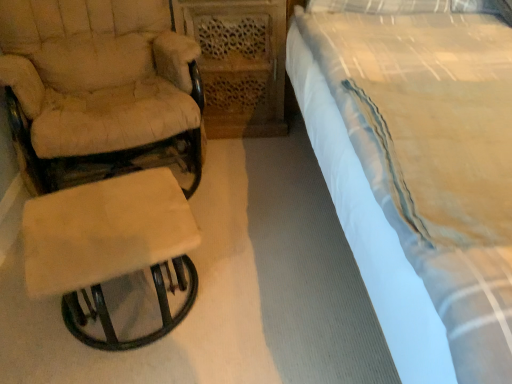
Question: Considering the relative sizes of beige fabric stool at left and white cotton bed at right in the image provided, is beige fabric stool at left bigger than white cotton bed at right?

Choices:
 (A) yes
 (B) no

Answer: (B)

Question: From a real-world perspective, is beige fabric stool at left under white cotton bed at right?

Choices:
 (A) yes
 (B) no

Answer: (A)

Question: Is beige fabric stool at left wider than white cotton bed at right?

Choices:
 (A) yes
 (B) no

Answer: (B)

Question: From the image's perspective, is beige fabric stool at left below white cotton bed at right?

Choices:
 (A) no
 (B) yes

Answer: (B)

Question: Considering the relative sizes of beige fabric stool at left and white cotton bed at right in the image provided, is beige fabric stool at left thinner than white cotton bed at right?

Choices:
 (A) yes
 (B) no

Answer: (A)

Question: Is beige fabric stool at left to the right of white cotton bed at right from the viewer's perspective?

Choices:
 (A) no
 (B) yes

Answer: (A)

Question: Is white cotton bed at right wider than beige fabric chair at left?

Choices:
 (A) yes
 (B) no

Answer: (A)

Question: From the image's perspective, is white cotton bed at right over beige fabric chair at left?

Choices:
 (A) yes
 (B) no

Answer: (B)

Question: Can you confirm if white cotton bed at right is taller than beige fabric chair at left?

Choices:
 (A) yes
 (B) no

Answer: (A)

Question: Considering the relative positions of white cotton bed at right and beige fabric chair at left in the image provided, is white cotton bed at right to the left of beige fabric chair at left from the viewer's perspective?

Choices:
 (A) no
 (B) yes

Answer: (A)

Question: Is white cotton bed at right closer to camera compared to beige fabric chair at left?

Choices:
 (A) no
 (B) yes

Answer: (B)

Question: Does white cotton bed at right have a larger size compared to beige fabric chair at left?

Choices:
 (A) no
 (B) yes

Answer: (B)

Question: Is white cotton bed at right located within beige fabric chair at left?

Choices:
 (A) yes
 (B) no

Answer: (B)